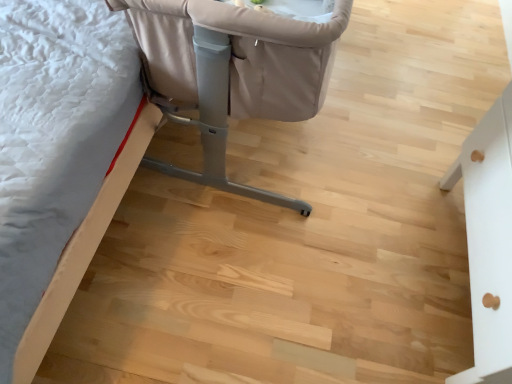
Find the location of `blank space above beige fabric crib at upper left, which is counted as the first furniture, starting from the left (from a real-world perspective)`. blank space above beige fabric crib at upper left, which is counted as the first furniture, starting from the left (from a real-world perspective) is located at coordinates (323, 182).